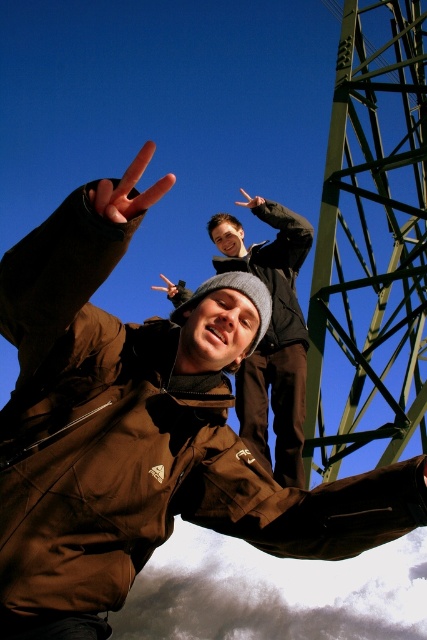
Question: Does matte black hand at center have a smaller size compared to matte black hand at upper center?

Choices:
 (A) no
 (B) yes

Answer: (B)

Question: Which point is closer to the camera taking this photo?

Choices:
 (A) (376, 104)
 (B) (157, 288)
 (C) (152, 196)

Answer: (C)

Question: Which object appears farthest from the camera in this image?

Choices:
 (A) brown fabric hand at upper center
 (B) green metallic tower at upper right
 (C) matte black hand at center

Answer: (C)

Question: Based on their relative distances, which object is nearer to the dark brown jacket at upper center?

Choices:
 (A) pinkish flesh-toned finger at upper center
 (B) matte black hand at upper center

Answer: (B)

Question: Does pinkish flesh-toned finger at upper center appear on the right side of matte black hand at upper center?

Choices:
 (A) no
 (B) yes

Answer: (A)

Question: Is the position of brown fabric hand at upper center less distant than that of matte black hand at upper center?

Choices:
 (A) no
 (B) yes

Answer: (B)